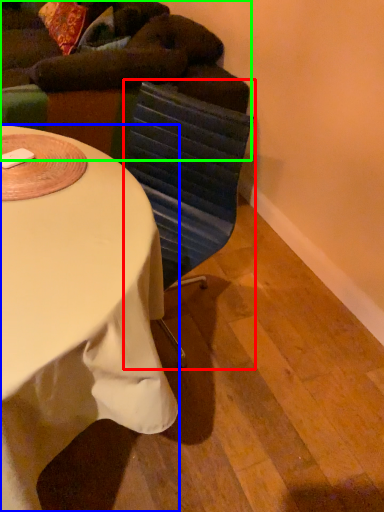
Question: Which object is the farthest from swivel chair (highlighted by a red box)? Choose among these: desk (highlighted by a blue box) or bean bag chair (highlighted by a green box).

Choices:
 (A) desk
 (B) bean bag chair

Answer: (B)